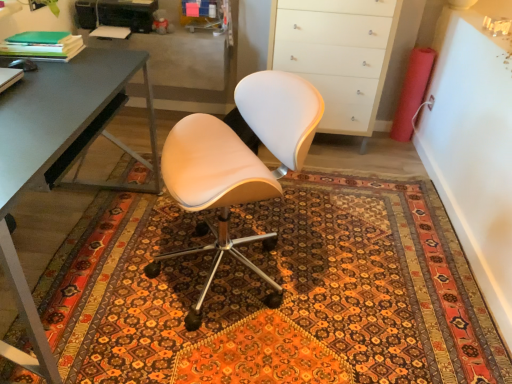
Question: Is matte white chair at center not near green matte folder at upper left?

Choices:
 (A) no
 (B) yes

Answer: (A)

Question: Is matte white chair at center bigger than green matte folder at upper left?

Choices:
 (A) no
 (B) yes

Answer: (B)

Question: From a real-world perspective, does matte white chair at center sit lower than green matte folder at upper left?

Choices:
 (A) no
 (B) yes

Answer: (B)

Question: From a real-world perspective, is matte white chair at center on green matte folder at upper left?

Choices:
 (A) yes
 (B) no

Answer: (B)

Question: Considering the relative positions of matte white chair at center and green matte folder at upper left in the image provided, is matte white chair at center to the left of green matte folder at upper left from the viewer's perspective?

Choices:
 (A) no
 (B) yes

Answer: (A)

Question: From their relative heights in the image, would you say patterned carpet at center is taller or shorter than green matte folder at upper left?

Choices:
 (A) short
 (B) tall

Answer: (A)

Question: Does point (98, 314) appear closer or farther from the camera than point (42, 36)?

Choices:
 (A) closer
 (B) farther

Answer: (A)

Question: In the image, is patterned carpet at center positioned in front of or behind green matte folder at upper left?

Choices:
 (A) behind
 (B) front

Answer: (B)

Question: From the image's perspective, is patterned carpet at center above or below green matte folder at upper left?

Choices:
 (A) above
 (B) below

Answer: (B)

Question: In the image, is matte white chair at center positioned in front of or behind metallic gray desk at left?

Choices:
 (A) behind
 (B) front

Answer: (A)

Question: Is matte white chair at center to the left or to the right of metallic gray desk at left in the image?

Choices:
 (A) left
 (B) right

Answer: (B)

Question: Is point (273, 144) positioned closer to the camera than point (118, 56)?

Choices:
 (A) closer
 (B) farther

Answer: (A)

Question: In terms of height, does matte white chair at center look taller or shorter compared to metallic gray desk at left?

Choices:
 (A) tall
 (B) short

Answer: (A)

Question: From the image's perspective, is green matte folder at upper left above or below matte white chair at center?

Choices:
 (A) above
 (B) below

Answer: (A)

Question: Does point (27, 31) appear closer or farther from the camera than point (266, 178)?

Choices:
 (A) closer
 (B) farther

Answer: (B)